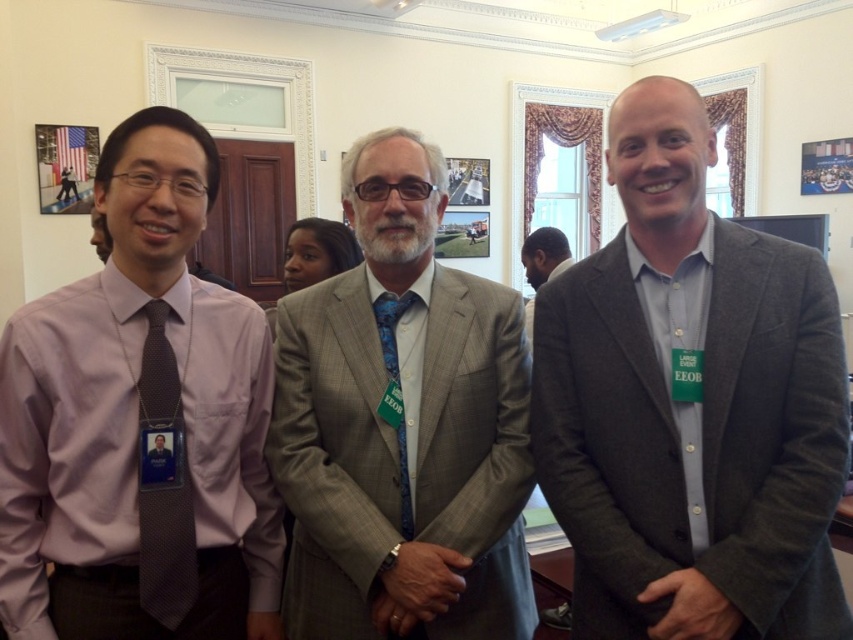
You are a photographer setting up for a group photo. You notice the silver metallic watch at center and the blue silk tie at center in the scene. Which object should you focus on first to ensure both are in sharp focus?

You should focus on the silver metallic watch at center first because it is closer to the viewer than the blue silk tie at center, ensuring both will be in focus when using proper depth of field.

You are a photographer setting up for a group photo. You want to ensure that both the gray wool blazer at right and the purple textured shirt at left are clearly visible in the frame. Based on their positions, which one might block the other if they stand closer together?

The gray wool blazer at right is in front of the purple textured shirt at left, so if they stand closer together, the gray wool blazer at right might block the view of the purple textured shirt at left.

You are an event planner organizing a formal event. You need to ensure that all guests have their lanyards visible for security. You notice the silver metallic watch at center and the blue silk tie at center. Which item is positioned lower on the person wearing them?

The silver metallic watch at center is positioned lower because it is below the blue silk tie at center.